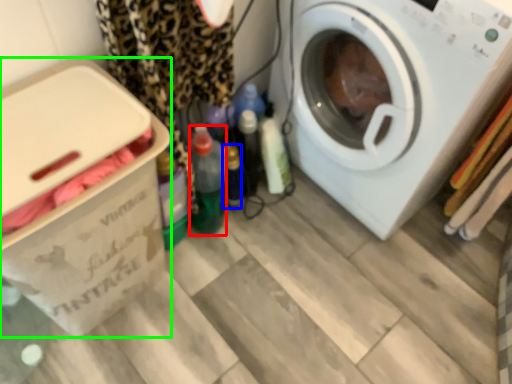
Question: Estimate the real-world distances between objects in this image. Which object is closer to bottle (highlighted by a red box), bottle (highlighted by a blue box) or cardboard box (highlighted by a green box)?

Choices:
 (A) bottle
 (B) cardboard box

Answer: (A)